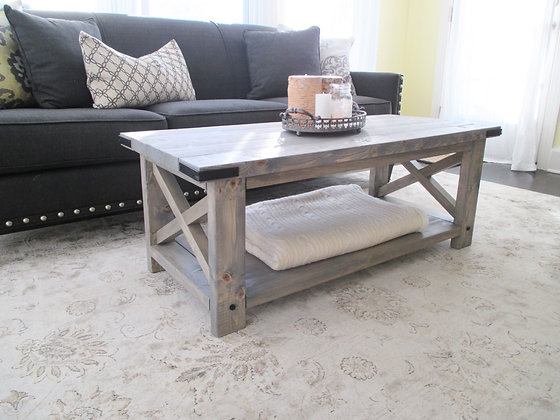
Where is `center table`? center table is located at coordinates (333, 156).